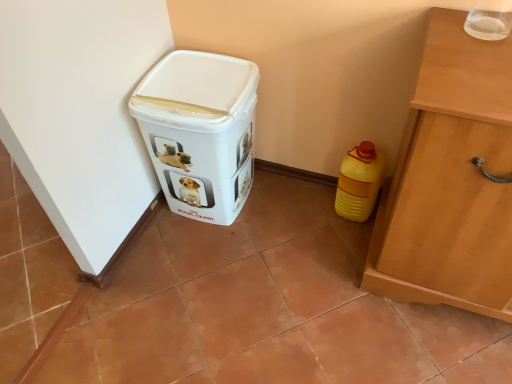
Question: Is white plastic container at lower left closer to camera compared to yellow plastic bottle at lower right?

Choices:
 (A) no
 (B) yes

Answer: (B)

Question: Considering the relative sizes of white plastic container at lower left and yellow plastic bottle at lower right in the image provided, is white plastic container at lower left taller than yellow plastic bottle at lower right?

Choices:
 (A) yes
 (B) no

Answer: (A)

Question: Is white plastic container at lower left not near yellow plastic bottle at lower right?

Choices:
 (A) no
 (B) yes

Answer: (A)

Question: From the image's perspective, would you say white plastic container at lower left is positioned over yellow plastic bottle at lower right?

Choices:
 (A) no
 (B) yes

Answer: (B)

Question: From the image's perspective, is white plastic container at lower left beneath yellow plastic bottle at lower right?

Choices:
 (A) yes
 (B) no

Answer: (B)

Question: Does white plastic container at lower left have a greater width compared to yellow plastic bottle at lower right?

Choices:
 (A) yes
 (B) no

Answer: (A)

Question: Is yellow plastic bottle at lower right to the left of white plastic container at lower left from the viewer's perspective?

Choices:
 (A) yes
 (B) no

Answer: (B)

Question: Does yellow plastic bottle at lower right have a greater width compared to white plastic container at lower left?

Choices:
 (A) no
 (B) yes

Answer: (A)

Question: Does yellow plastic bottle at lower right have a larger size compared to white plastic container at lower left?

Choices:
 (A) no
 (B) yes

Answer: (A)

Question: From a real-world perspective, is yellow plastic bottle at lower right located higher than white plastic container at lower left?

Choices:
 (A) no
 (B) yes

Answer: (A)

Question: From the image's perspective, would you say yellow plastic bottle at lower right is positioned over white plastic container at lower left?

Choices:
 (A) yes
 (B) no

Answer: (B)

Question: Is there a large distance between yellow plastic bottle at lower right and white plastic container at lower left?

Choices:
 (A) yes
 (B) no

Answer: (B)

Question: From a real-world perspective, is white plastic container at lower left positioned above or below yellow plastic bottle at lower right?

Choices:
 (A) above
 (B) below

Answer: (A)